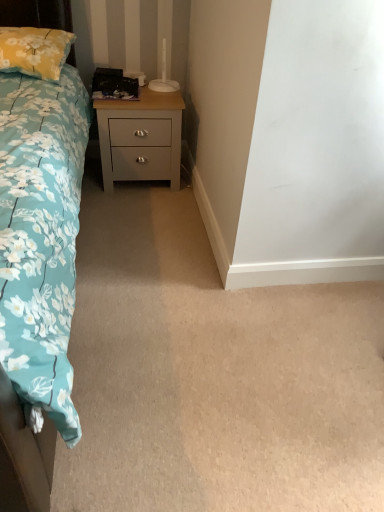
Find the location of a particular element. The image size is (384, 512). satin gray wood nightstand at center is located at coordinates [x=141, y=138].

From the picture: In order to face blue floral fabric bed at left, should I rotate leftwards or rightwards?

A 25.098 degree turn to the left will do.

The image size is (384, 512). I want to click on yellow floral pillow at upper left, so click(x=34, y=51).

At what (x,y) coordinates should I click in order to perform the action: click on satin gray wood nightstand at center. Please return your answer as a coordinate pair (x, y). Looking at the image, I should click on (141, 138).

Find the location of a particular element. pillow on the left side of satin gray wood nightstand at center is located at coordinates (34, 51).

Looking at this image, which object is positioned more to the left, satin gray wood nightstand at center or yellow floral pillow at upper left?

yellow floral pillow at upper left.

From the image's perspective, between satin gray wood nightstand at center and yellow floral pillow at upper left, which one is located above?

yellow floral pillow at upper left is shown above in the image.

Is blue floral fabric bed at left facing towards yellow floral pillow at upper left?

No, blue floral fabric bed at left is not oriented towards yellow floral pillow at upper left.

Is blue floral fabric bed at left with yellow floral pillow at upper left?

blue floral fabric bed at left is not next to yellow floral pillow at upper left, and they're not touching.

From a real-world perspective, does blue floral fabric bed at left sit lower than yellow floral pillow at upper left?

Correct, in the physical world, blue floral fabric bed at left is lower than yellow floral pillow at upper left.

From the image's perspective, between blue floral fabric bed at left and yellow floral pillow at upper left, who is located below?

blue floral fabric bed at left is shown below in the image.

Which object is positioned more to the left, blue floral fabric bed at left or satin gray wood nightstand at center?

blue floral fabric bed at left.

From the picture: Is blue floral fabric bed at left far from satin gray wood nightstand at center?

Yes, blue floral fabric bed at left and satin gray wood nightstand at center are located far from each other.

What's the angular difference between blue floral fabric bed at left and satin gray wood nightstand at center's facing directions?

blue floral fabric bed at left and satin gray wood nightstand at center are facing 0.907 degrees away from each other.

Can satin gray wood nightstand at center be found inside yellow floral pillow at upper left?

Actually, satin gray wood nightstand at center is outside yellow floral pillow at upper left.

Based on the photo, relative to satin gray wood nightstand at center, is yellow floral pillow at upper left in front or behind?

Visually, yellow floral pillow at upper left is located in front of satin gray wood nightstand at center.

Considering the sizes of objects yellow floral pillow at upper left and satin gray wood nightstand at center in the image provided, who is taller, yellow floral pillow at upper left or satin gray wood nightstand at center?

satin gray wood nightstand at center.

Looking at this image, does yellow floral pillow at upper left have a greater width compared to satin gray wood nightstand at center?

Indeed, yellow floral pillow at upper left has a greater width compared to satin gray wood nightstand at center.

Consider the image. Is yellow floral pillow at upper left positioned with its back to blue floral fabric bed at left?

Yes, yellow floral pillow at upper left's orientation is away from blue floral fabric bed at left.

Which is behind, point (34, 69) or point (70, 22)?

Positioned behind is point (70, 22).

Does yellow floral pillow at upper left have a smaller size compared to blue floral fabric bed at left?

Yes.

From the image's perspective, is yellow floral pillow at upper left located above or below blue floral fabric bed at left?

yellow floral pillow at upper left is situated higher than blue floral fabric bed at left in the image.

From the image's perspective, which object appears higher, satin gray wood nightstand at center or blue floral fabric bed at left?

satin gray wood nightstand at center is shown above in the image.

Is the surface of satin gray wood nightstand at center in direct contact with blue floral fabric bed at left?

satin gray wood nightstand at center is not next to blue floral fabric bed at left, and they're not touching.

In the image, there is a satin gray wood nightstand at center. Where is `pillow above it (from the image's perspective)`? This screenshot has width=384, height=512. pillow above it (from the image's perspective) is located at coordinates (34, 51).

The image size is (384, 512). Find the location of `bed on the right of yellow floral pillow at upper left`. bed on the right of yellow floral pillow at upper left is located at coordinates click(x=23, y=458).

Considering their positions, is blue floral fabric bed at left positioned closer to satin gray wood nightstand at center than yellow floral pillow at upper left?

Based on the image, yellow floral pillow at upper left appears to be nearer to satin gray wood nightstand at center.

Considering their positions, is satin gray wood nightstand at center positioned closer to yellow floral pillow at upper left than blue floral fabric bed at left?

Based on the image, satin gray wood nightstand at center appears to be nearer to yellow floral pillow at upper left.

Based on their spatial positions, is satin gray wood nightstand at center or yellow floral pillow at upper left closer to blue floral fabric bed at left?

Based on the image, satin gray wood nightstand at center appears to be nearer to blue floral fabric bed at left.

From the image, which object appears to be farther from satin gray wood nightstand at center, yellow floral pillow at upper left or blue floral fabric bed at left?

Based on the image, blue floral fabric bed at left appears to be further to satin gray wood nightstand at center.

Which object lies nearer to the anchor point blue floral fabric bed at left, yellow floral pillow at upper left or satin gray wood nightstand at center?

satin gray wood nightstand at center.

Considering their positions, is blue floral fabric bed at left positioned further to yellow floral pillow at upper left than satin gray wood nightstand at center?

blue floral fabric bed at left is positioned further to the anchor yellow floral pillow at upper left.

Where is `pillow positioned between blue floral fabric bed at left and satin gray wood nightstand at center from near to far`? This screenshot has width=384, height=512. pillow positioned between blue floral fabric bed at left and satin gray wood nightstand at center from near to far is located at coordinates (34, 51).